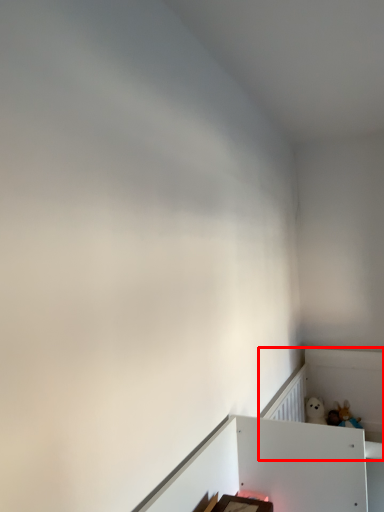
Question: In this image, where is bed frame (annotated by the red box) located relative to toy?

Choices:
 (A) right
 (B) left

Answer: (B)